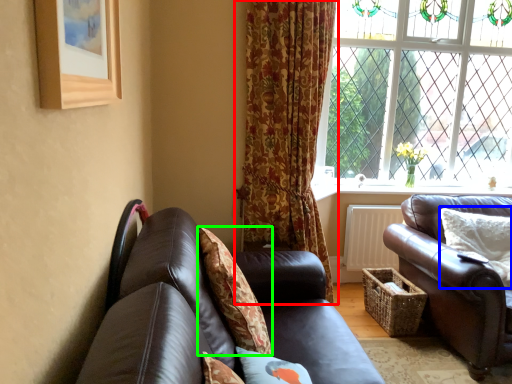
Question: Which object is the farthest from curtain (highlighted by a red box)? Choose among these: pillow (highlighted by a blue box) or pillow (highlighted by a green box).

Choices:
 (A) pillow
 (B) pillow

Answer: (A)